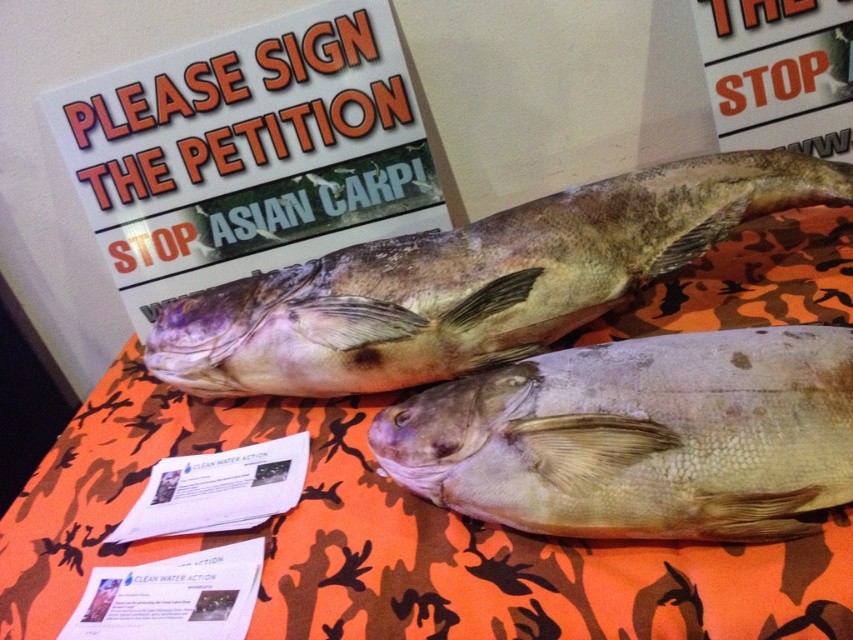
You are a graphic designer asked to create a poster using elements from the image. The client wants the white paper sign at upper left and the grayish matte fish at center to be clearly visible. Given their sizes, which element should be placed closer to the viewer in the poster design?

The white paper sign at upper left should be placed closer to the viewer since it has a larger size compared to the grayish matte fish at center, ensuring both elements remain clearly visible.

You are at a protest event and see the orange camo table at center and the white paper sign at upper left. Which object is positioned more to the left side of the scene?

The white paper sign at upper left is positioned more to the left side of the scene than the orange camo table at center.

You are a photographer trying to capture a closeup of the fish on the table. You notice two points marked on the image. Which point is closer to your camera lens, point 1 at coordinates point (x=193, y=403) or point 2 at coordinates point (x=724, y=10)?

Point 1 at coordinates point (x=193, y=403) is closer to the camera lens because it is further to the camera than point 2 at coordinates point (x=724, y=10).